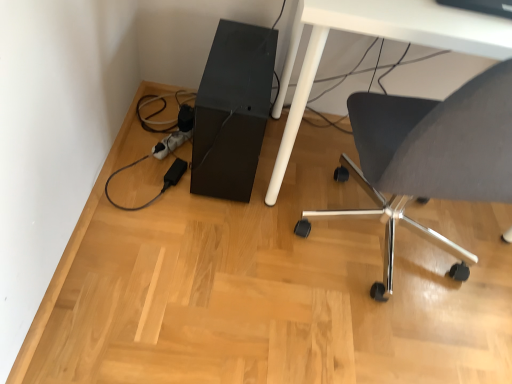
At what (x,y) coordinates should I click in order to perform the action: click on free region under matte gray chair at lower right (from a real-world perspective). Please return your answer as a coordinate pair (x, y). This screenshot has width=512, height=384. Looking at the image, I should click on (374, 264).